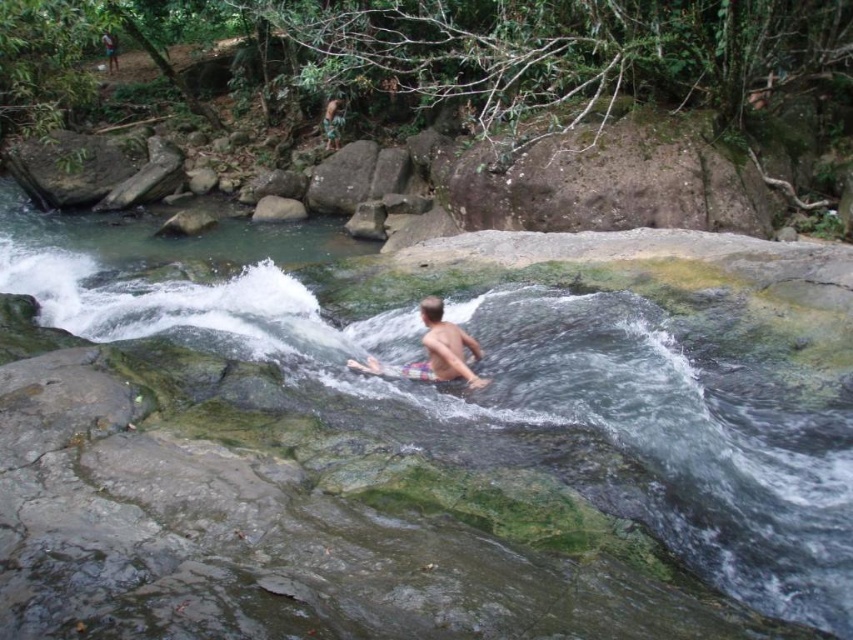
Between point (257, 339) and point (430, 323), which one is positioned in front?

Positioned in front is point (430, 323).

Describe the element at coordinates (669, 444) in the screenshot. I see `clear water at stream center` at that location.

Is point (801, 596) positioned after point (378, 371)?

No, it is not.

Where is `clear water at stream center`? This screenshot has width=853, height=640. clear water at stream center is located at coordinates (669, 444).